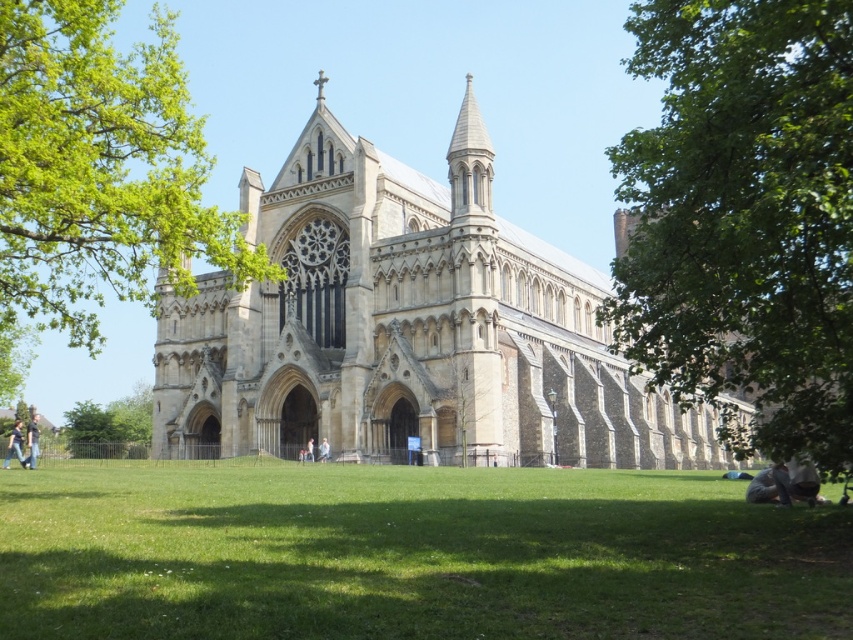
Is light blue fabric at center to the right of light brown leather jacket at center from the viewer's perspective?

Yes, light blue fabric at center is to the right of light brown leather jacket at center.

Does light blue fabric at center have a smaller size compared to light brown leather jacket at center?

Indeed, light blue fabric at center has a smaller size compared to light brown leather jacket at center.

Does point (320, 456) lie behind point (310, 458)?

No, (320, 456) is closer to viewer.

Where is `light blue fabric at center`? The height and width of the screenshot is (640, 853). light blue fabric at center is located at coordinates (323, 451).

Which is in front, point (64, 224) or point (32, 442)?

Point (64, 224) is more forward.

Can you confirm if green leafy tree at center is bigger than light blue jeans at lower left?

Indeed, green leafy tree at center has a larger size compared to light blue jeans at lower left.

Where is `green leafy tree at center`? green leafy tree at center is located at coordinates (100, 168).

Does green grass at center appear under light blue jeans at lower left?

Correct, green grass at center is located below light blue jeans at lower left.

Which is behind, point (602, 516) or point (38, 445)?

The point (38, 445) is behind.

The height and width of the screenshot is (640, 853). Describe the element at coordinates (412, 554) in the screenshot. I see `green grass at center` at that location.

Locate an element on the screen. green grass at center is located at coordinates (412, 554).